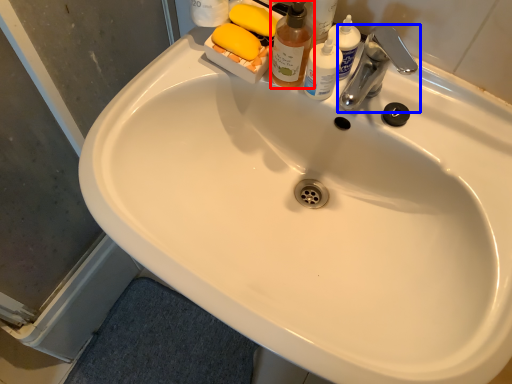
Question: Which object appears closest to the camera in this image, cleaning product (highlighted by a red box) or tap (highlighted by a blue box)?

Choices:
 (A) cleaning product
 (B) tap

Answer: (A)